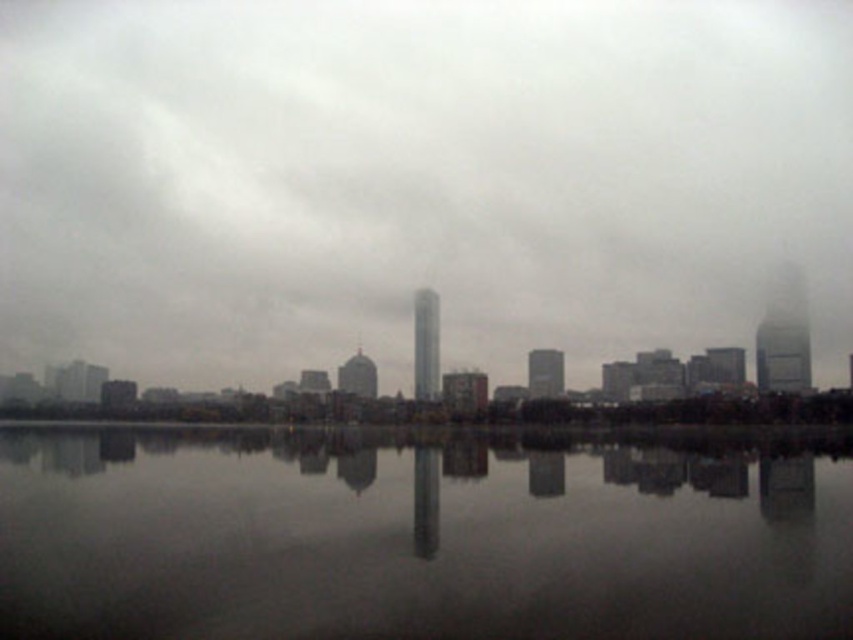
Question: From the image, what is the correct spatial relationship of gray foggy sky at center in relation to reflective glass water at center?

Choices:
 (A) above
 (B) below

Answer: (A)

Question: Can you confirm if gray foggy sky at center is wider than reflective glass water at center?

Choices:
 (A) yes
 (B) no

Answer: (A)

Question: Which object is closer to the camera taking this photo?

Choices:
 (A) reflective glass water at center
 (B) gray foggy sky at center

Answer: (A)

Question: Can you confirm if gray foggy sky at center is positioned below reflective glass water at center?

Choices:
 (A) yes
 (B) no

Answer: (B)